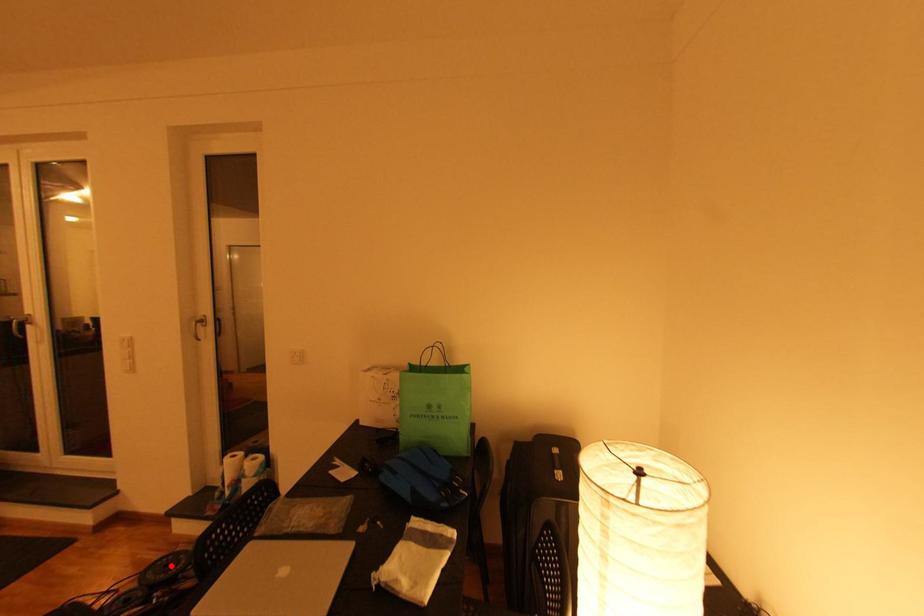
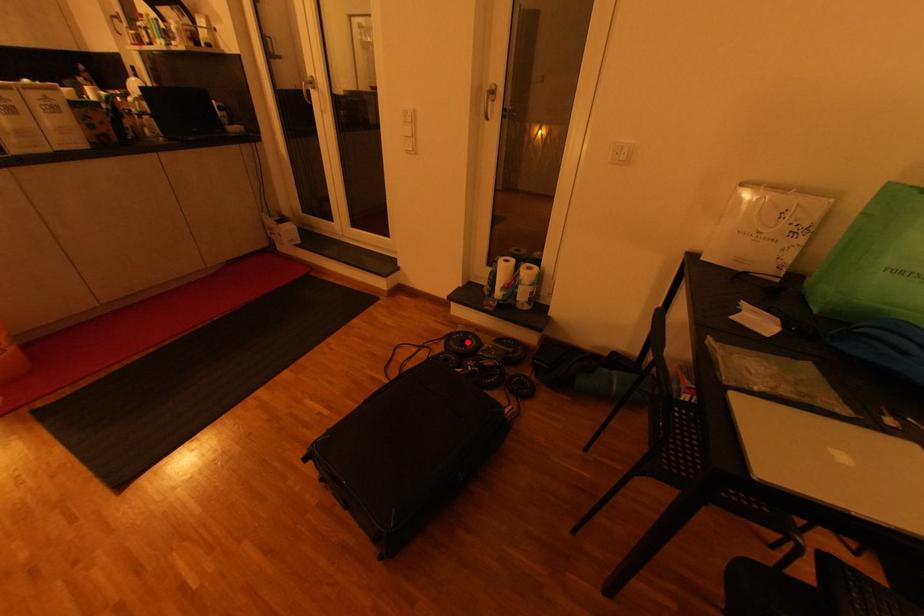
I am providing you with two images of the same scene from different viewpoints. A red point is marked on the first image and another point is marked on the second image. Is the red point in image1 aligned with the point shown in image2?

Yes